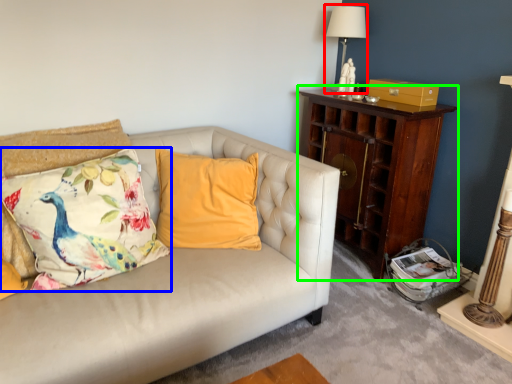
Question: Considering the real-world distances, which object is closest to table lamp (highlighted by a red box)? pillow (highlighted by a blue box) or nightstand (highlighted by a green box).

Choices:
 (A) pillow
 (B) nightstand

Answer: (B)